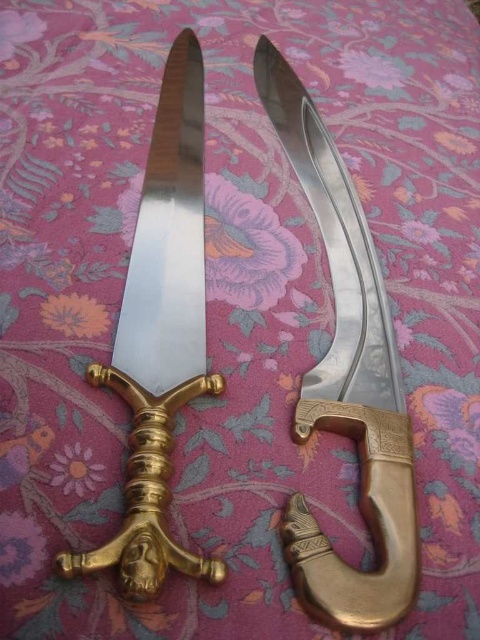
Question: From the image, what is the correct spatial relationship of polished brass dagger at center in relation to polished brass sword at center?

Choices:
 (A) right
 (B) left

Answer: (A)

Question: Based on their relative distances, which object is nearer to the polished brass sword at center?

Choices:
 (A) polished metal knife at center
 (B) polished brass dagger at center

Answer: (A)

Question: Can you confirm if polished brass dagger at center is positioned above polished brass sword at center?

Choices:
 (A) yes
 (B) no

Answer: (B)

Question: Considering the relative positions of polished brass sword at center and polished metal knife at center in the image provided, where is polished brass sword at center located with respect to polished metal knife at center?

Choices:
 (A) left
 (B) right

Answer: (B)

Question: Which of these objects is positioned farthest from the polished metal knife at center?

Choices:
 (A) polished brass dagger at center
 (B) polished brass sword at center

Answer: (A)

Question: Based on their relative distances, which object is nearer to the polished brass sword at center?

Choices:
 (A) polished brass dagger at center
 (B) polished metal knife at center

Answer: (B)